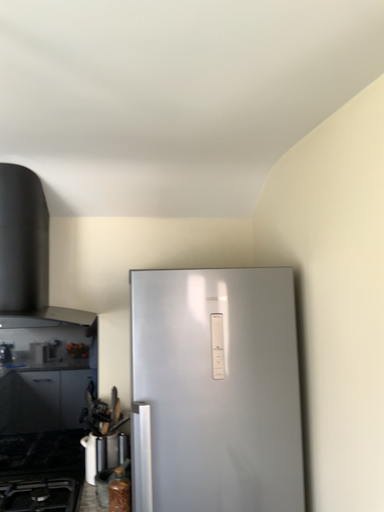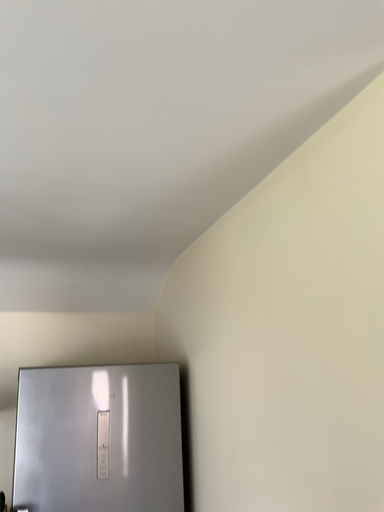
Question: How did the camera likely rotate when shooting the video?

Choices:
 (A) rotated upward
 (B) rotated downward

Answer: (A)